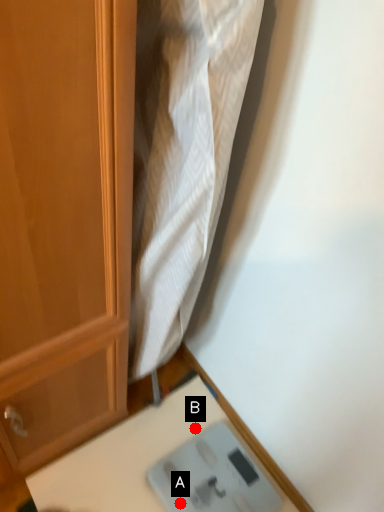
Question: Two points are circled on the image, labeled by A and B beside each circle. Which point is closer to the camera?

Choices:
 (A) A is closer
 (B) B is closer

Answer: (A)